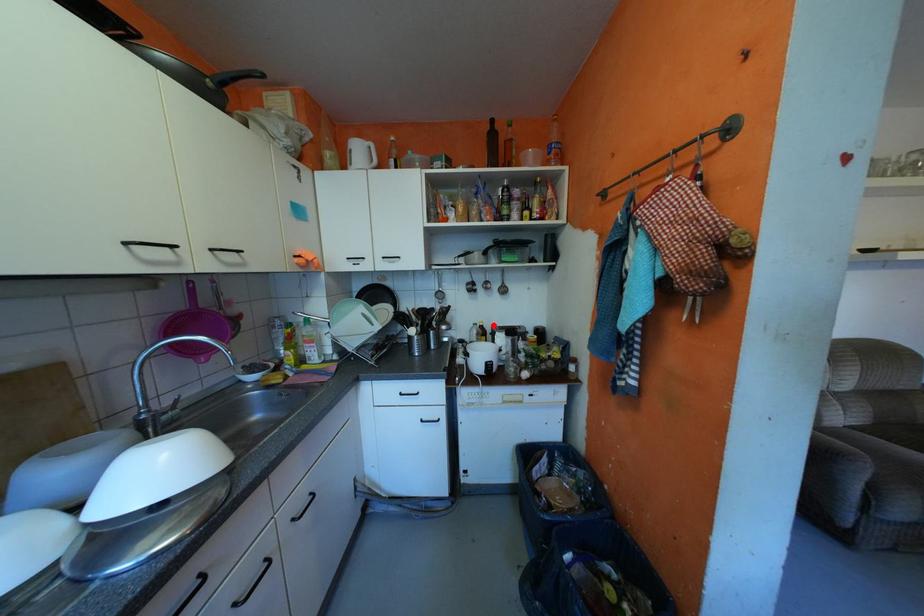
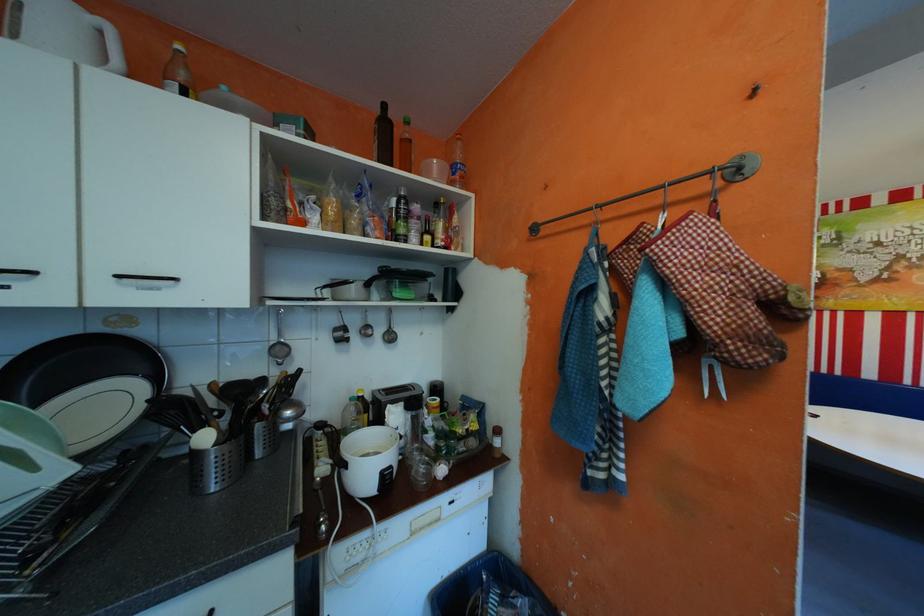
Locate, in the second image, the point that corresponds to the highlighted location in the first image.

(372, 397)